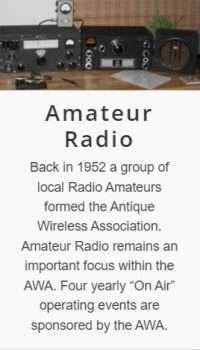
Find the location of a particular element. The width and height of the screenshot is (200, 350). plant is located at coordinates (163, 21).